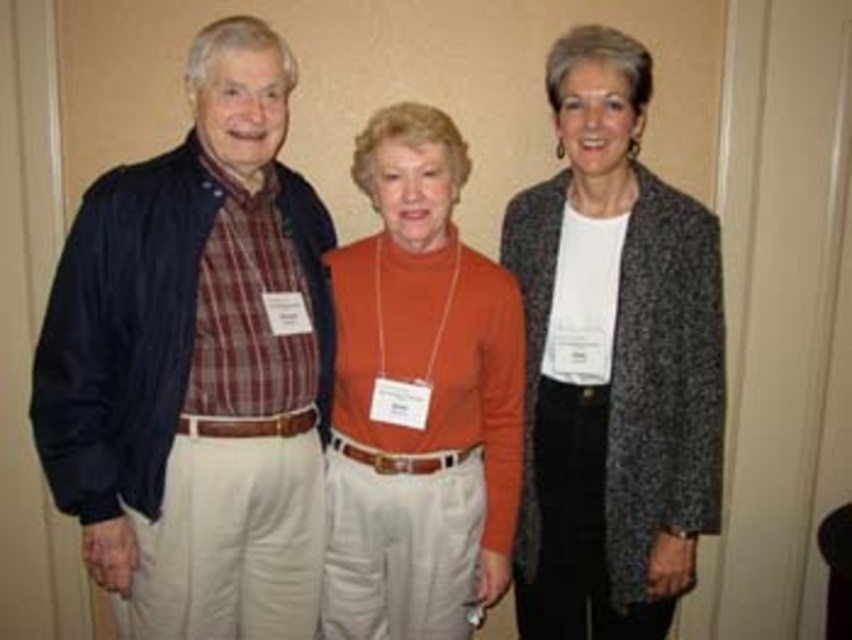
Based on the scene description, where is the speckled woolen cardigan at center located in relation to the other objects?

The speckled woolen cardigan at center is located at the center position between the older man on the left and the woman in the dark patterned blazer on the right.

Based on the scene description, which clothing item is closer to the viewer between the speckled woolen cardigan at center and the orange turtleneck sweater at center?

The speckled woolen cardigan at center is closer to the viewer because the orange turtleneck sweater at center is behind it.

Based on the scene description, which clothing item is shorter in height between the matte black jacket at left and the speckled woolen cardigan at center?

The matte black jacket at left is shorter in height compared to the speckled woolen cardigan at center.